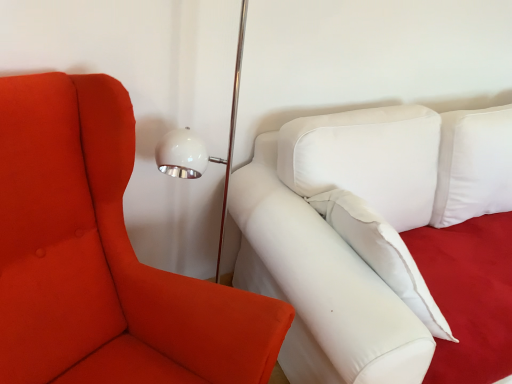
Question: Is white fabric studio couch at center bigger or smaller than matte orange fabric chair at left?

Choices:
 (A) small
 (B) big

Answer: (B)

Question: Is point (454, 216) closer or farther from the camera than point (47, 244)?

Choices:
 (A) closer
 (B) farther

Answer: (B)

Question: Is white fabric studio couch at center situated inside matte orange fabric chair at left or outside?

Choices:
 (A) inside
 (B) outside

Answer: (B)

Question: In the image, is matte orange fabric chair at left positioned in front of or behind white fabric studio couch at center?

Choices:
 (A) behind
 (B) front

Answer: (B)

Question: Is point (29, 218) closer or farther from the camera than point (338, 249)?

Choices:
 (A) farther
 (B) closer

Answer: (B)

Question: Which is correct: matte orange fabric chair at left is inside white fabric studio couch at center, or outside of it?

Choices:
 (A) inside
 (B) outside

Answer: (B)

Question: Considering the positions of matte orange fabric chair at left and white fabric studio couch at center in the image, is matte orange fabric chair at left taller or shorter than white fabric studio couch at center?

Choices:
 (A) short
 (B) tall

Answer: (B)